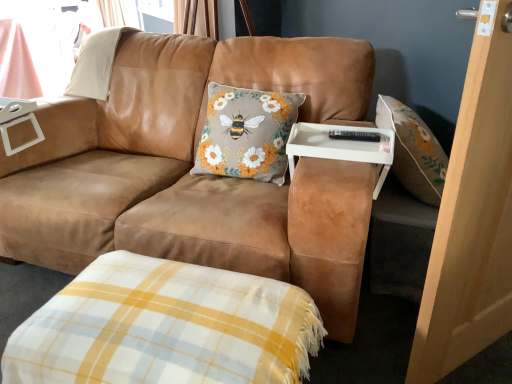
Find the location of a particular element. The height and width of the screenshot is (384, 512). suede brown couch at center is located at coordinates (198, 176).

Is light brown wood screen door at right not close to suede brown couch at center?

No, light brown wood screen door at right is not far away from suede brown couch at center.

How many degrees apart are the facing directions of light brown wood screen door at right and suede brown couch at center?

The facing directions of light brown wood screen door at right and suede brown couch at center are 54.6 degrees apart.

From a real-world perspective, is light brown wood screen door at right located higher than suede brown couch at center?

Yes.

Would you say white plastic tray at center is inside or outside yellow and white plaid blanket at lower center?

white plastic tray at center is not enclosed by yellow and white plaid blanket at lower center.

Considering the relative positions of white plastic tray at center and yellow and white plaid blanket at lower center in the image provided, is white plastic tray at center behind yellow and white plaid blanket at lower center?

Yes.

From their relative heights in the image, would you say white plastic tray at center is taller or shorter than yellow and white plaid blanket at lower center?

Clearly, white plastic tray at center is shorter compared to yellow and white plaid blanket at lower center.

Where is `table above the yellow and white plaid blanket at lower center (from the image's perspective)`? table above the yellow and white plaid blanket at lower center (from the image's perspective) is located at coordinates (341, 147).

Is light brown wood screen door at right to the left of white plastic tray at center from the viewer's perspective?

No.

Considering the sizes of objects light brown wood screen door at right and white plastic tray at center in the image provided, who is wider, light brown wood screen door at right or white plastic tray at center?

With larger width is white plastic tray at center.

Is light brown wood screen door at right looking in the opposite direction of white plastic tray at center?

That's right, light brown wood screen door at right is facing away from white plastic tray at center.

Is light brown wood screen door at right not near white plastic tray at center?

No, light brown wood screen door at right is in close proximity to white plastic tray at center.

Is yellow and white plaid blanket at lower center smaller than light brown wood screen door at right?

Yes, yellow and white plaid blanket at lower center is smaller than light brown wood screen door at right.

Based on the photo, is yellow and white plaid blanket at lower center not close to light brown wood screen door at right?

No.

Does yellow and white plaid blanket at lower center contain light brown wood screen door at right?

No, light brown wood screen door at right is not inside yellow and white plaid blanket at lower center.

Would you say yellow and white plaid blanket at lower center is outside white plastic tray at center?

yellow and white plaid blanket at lower center is positioned outside white plastic tray at center.

From the image's perspective, who appears lower, yellow and white plaid blanket at lower center or white plastic tray at center?

yellow and white plaid blanket at lower center.

In terms of size, does yellow and white plaid blanket at lower center appear bigger or smaller than white plastic tray at center?

In the image, yellow and white plaid blanket at lower center appears to be larger than white plastic tray at center.

Is yellow and white plaid blanket at lower center aimed at white plastic tray at center?

No, yellow and white plaid blanket at lower center is not oriented towards white plastic tray at center.

Considering the sizes of objects light brown wood screen door at right and yellow and white plaid blanket at lower center in the image provided, who is thinner, light brown wood screen door at right or yellow and white plaid blanket at lower center?

With smaller width is light brown wood screen door at right.

Considering the sizes of light brown wood screen door at right and yellow and white plaid blanket at lower center in the image, is light brown wood screen door at right bigger or smaller than yellow and white plaid blanket at lower center?

Considering their sizes, light brown wood screen door at right takes up more space than yellow and white plaid blanket at lower center.

Is point (485, 63) in front of point (65, 346)?

Yes.

Would you say light brown wood screen door at right is a long distance from yellow and white plaid blanket at lower center?

No, light brown wood screen door at right is in close proximity to yellow and white plaid blanket at lower center.

From the image's perspective, is suede brown couch at center located above light brown wood screen door at right?

Yes, from the image's perspective, suede brown couch at center is on top of light brown wood screen door at right.

Does suede brown couch at center have a lesser width compared to light brown wood screen door at right?

No.

The height and width of the screenshot is (384, 512). In order to click on studio couch above the light brown wood screen door at right (from the image's perspective) in this screenshot , I will do `click(198, 176)`.

Where is `studio couch that is above the light brown wood screen door at right (from the image's perspective)`? Image resolution: width=512 pixels, height=384 pixels. studio couch that is above the light brown wood screen door at right (from the image's perspective) is located at coordinates (198, 176).

This screenshot has height=384, width=512. Identify the location of table that is on the right side of yellow and white plaid blanket at lower center. (341, 147).

From the image, which object appears to be farther from suede brown couch at center, yellow and white plaid blanket at lower center or white plastic tray at center?

yellow and white plaid blanket at lower center.

When comparing their distances from yellow and white plaid blanket at lower center, does light brown wood screen door at right or white plastic tray at center seem closer?

The object closer to yellow and white plaid blanket at lower center is white plastic tray at center.

Considering their positions, is light brown wood screen door at right positioned further to white plastic tray at center than yellow and white plaid blanket at lower center?

Based on the image, yellow and white plaid blanket at lower center appears to be further to white plastic tray at center.

Which object lies further to the anchor point yellow and white plaid blanket at lower center, suede brown couch at center or light brown wood screen door at right?

light brown wood screen door at right is positioned further to the anchor yellow and white plaid blanket at lower center.

Estimate the real-world distances between objects in this image. Which object is closer to light brown wood screen door at right, white plastic tray at center or suede brown couch at center?

The object closer to light brown wood screen door at right is white plastic tray at center.

Estimate the real-world distances between objects in this image. Which object is further from light brown wood screen door at right, white plastic tray at center or yellow and white plaid blanket at lower center?

yellow and white plaid blanket at lower center.

Based on their spatial positions, is suede brown couch at center or yellow and white plaid blanket at lower center closer to light brown wood screen door at right?

yellow and white plaid blanket at lower center lies closer to light brown wood screen door at right than the other object.

From the image, which object appears to be farther from white plastic tray at center, suede brown couch at center or yellow and white plaid blanket at lower center?

Among the two, yellow and white plaid blanket at lower center is located further to white plastic tray at center.

Find the location of `plaid between suede brown couch at center and white plastic tray at center`. plaid between suede brown couch at center and white plastic tray at center is located at coordinates (166, 327).

You are a GUI agent. You are given a task and a screenshot of the screen. Output one action in this format:
    pyautogui.click(x=<x>, y=<y>)
    Task: Click on the plaid between suede brown couch at center and light brown wood screen door at right from left to right
    The width and height of the screenshot is (512, 384).
    Given the screenshot: What is the action you would take?
    pyautogui.click(x=166, y=327)

You are a GUI agent. You are given a task and a screenshot of the screen. Output one action in this format:
    pyautogui.click(x=<x>, y=<y>)
    Task: Click on the table between suede brown couch at center and light brown wood screen door at right in the horizontal direction
    The image size is (512, 384).
    Given the screenshot: What is the action you would take?
    pyautogui.click(x=341, y=147)

The width and height of the screenshot is (512, 384). I want to click on table between yellow and white plaid blanket at lower center and light brown wood screen door at right in the horizontal direction, so click(x=341, y=147).